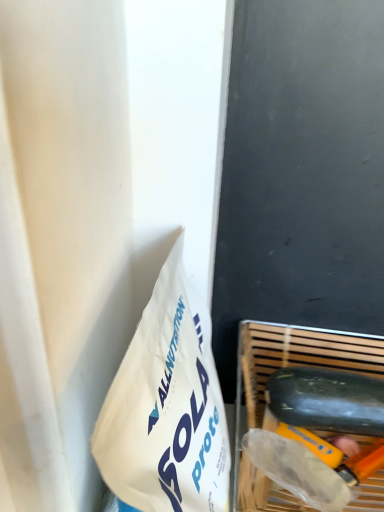
Locate an element on the screen. The height and width of the screenshot is (512, 384). smooth black cucumber at lower right is located at coordinates click(327, 400).

Describe the element at coordinates (327, 400) in the screenshot. I see `smooth black cucumber at lower right` at that location.

Describe the element at coordinates (283, 367) in the screenshot. I see `wooden slatted basket at lower right` at that location.

Find the location of `wooden slatted basket at lower right`. wooden slatted basket at lower right is located at coordinates (283, 367).

Identify the location of smooth black cucumber at lower right. The width and height of the screenshot is (384, 512). (327, 400).

Is smooth black cucumber at lower right to the right of wooden slatted basket at lower right from the viewer's perspective?

Indeed, smooth black cucumber at lower right is positioned on the right side of wooden slatted basket at lower right.

Which is in front, smooth black cucumber at lower right or wooden slatted basket at lower right?

Positioned in front is wooden slatted basket at lower right.

Is point (368, 419) less distant than point (371, 504)?

No, (368, 419) is further to viewer.

From the image's perspective, is smooth black cucumber at lower right above or below wooden slatted basket at lower right?

Clearly, from the image's perspective, smooth black cucumber at lower right is above wooden slatted basket at lower right.

From a real-world perspective, which object rests below the other?

wooden slatted basket at lower right is physically lower.

Is smooth black cucumber at lower right thinner than wooden slatted basket at lower right?

Yes.

Consider the image. Between smooth black cucumber at lower right and wooden slatted basket at lower right, which one has less height?

Standing shorter between the two is smooth black cucumber at lower right.

In terms of size, does smooth black cucumber at lower right appear bigger or smaller than wooden slatted basket at lower right?

In the image, smooth black cucumber at lower right appears to be smaller than wooden slatted basket at lower right.

Is smooth black cucumber at lower right outside of wooden slatted basket at lower right?

No, smooth black cucumber at lower right is inside or overlapping with wooden slatted basket at lower right.

Are smooth black cucumber at lower right and wooden slatted basket at lower right far apart?

No, smooth black cucumber at lower right is not far away from wooden slatted basket at lower right.

Is wooden slatted basket at lower right at the back of smooth black cucumber at lower right?

That's right, smooth black cucumber at lower right is facing away from wooden slatted basket at lower right.

How many degrees apart are the facing directions of smooth black cucumber at lower right and wooden slatted basket at lower right?

0.136 degrees separate the facing orientations of smooth black cucumber at lower right and wooden slatted basket at lower right.

Where is `cucumber that appears on the right of wooden slatted basket at lower right`? The height and width of the screenshot is (512, 384). cucumber that appears on the right of wooden slatted basket at lower right is located at coordinates (327, 400).

Which is more to the right, wooden slatted basket at lower right or smooth black cucumber at lower right?

smooth black cucumber at lower right is more to the right.

Between wooden slatted basket at lower right and smooth black cucumber at lower right, which one is positioned behind?

smooth black cucumber at lower right is more distant.

Considering the positions of point (238, 344) and point (314, 420), is point (238, 344) closer or farther from the camera than point (314, 420)?

Point (238, 344).

From the image's perspective, is wooden slatted basket at lower right located above or below smooth black cucumber at lower right?

Clearly, from the image's perspective, wooden slatted basket at lower right is below smooth black cucumber at lower right.

From a real-world perspective, which object stands above the other?

smooth black cucumber at lower right is physically above.

In terms of width, does wooden slatted basket at lower right look wider or thinner when compared to smooth black cucumber at lower right?

Clearly, wooden slatted basket at lower right has more width compared to smooth black cucumber at lower right.

Considering the relative sizes of wooden slatted basket at lower right and smooth black cucumber at lower right in the image provided, is wooden slatted basket at lower right taller than smooth black cucumber at lower right?

Yes.

Is wooden slatted basket at lower right bigger or smaller than smooth black cucumber at lower right?

wooden slatted basket at lower right is bigger than smooth black cucumber at lower right.

Would you say wooden slatted basket at lower right is outside smooth black cucumber at lower right?

wooden slatted basket at lower right lies outside smooth black cucumber at lower right's area.

From the picture: Is wooden slatted basket at lower right placed right next to smooth black cucumber at lower right?

Yes, wooden slatted basket at lower right is with smooth black cucumber at lower right.

Does wooden slatted basket at lower right turn towards smooth black cucumber at lower right?

Yes, wooden slatted basket at lower right is aimed at smooth black cucumber at lower right.

Measure the distance between wooden slatted basket at lower right and smooth black cucumber at lower right.

A distance of 2.12 inches exists between wooden slatted basket at lower right and smooth black cucumber at lower right.

At what (x,y) coordinates should I click in order to perform the action: click on cucumber above the wooden slatted basket at lower right (from a real-world perspective). Please return your answer as a coordinate pair (x, y). The height and width of the screenshot is (512, 384). Looking at the image, I should click on (327, 400).

Find the location of a particular element. The image size is (384, 512). cucumber behind the wooden slatted basket at lower right is located at coordinates (327, 400).

You are a GUI agent. You are given a task and a screenshot of the screen. Output one action in this format:
    pyautogui.click(x=<x>, y=<y>)
    Task: Click on the cucumber above the wooden slatted basket at lower right (from a real-world perspective)
    The height and width of the screenshot is (512, 384).
    Given the screenshot: What is the action you would take?
    pyautogui.click(x=327, y=400)